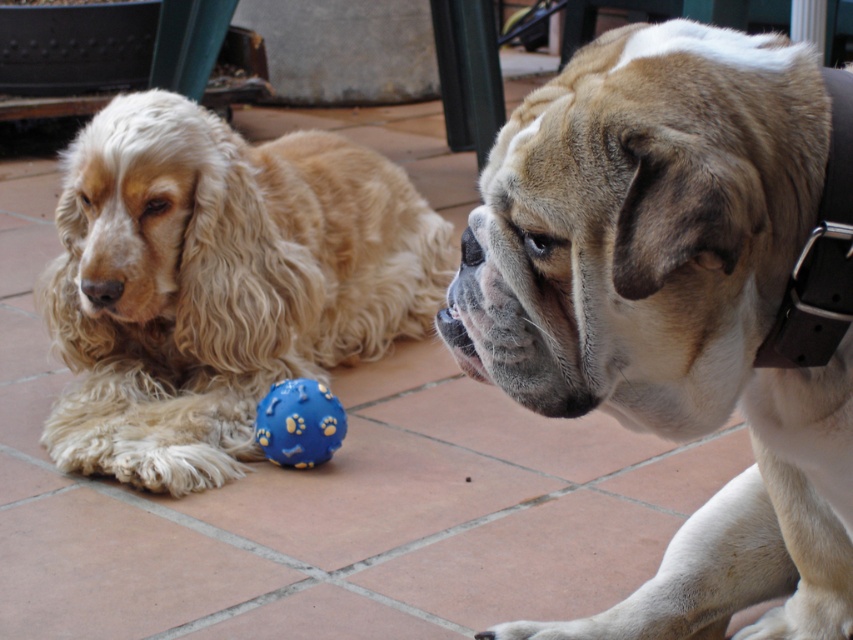
You are a dog trainer observing the two dogs in the scene. You notice the brown leather collar at center and the black rubber nose at center. Which object is positioned lower in the image?

The brown leather collar at center is below the black rubber nose at center, so the brown leather collar at center is positioned lower in the image.

You are a dog owner who wants to attach a GPS tracker to your dog. The tracker requires a collar width of at least 2 cm. Given the brown leather collar at center and the black rubber nose at center, which object can the GPS tracker be attached to?

The brown leather collar at center has a width that surpasses the black rubber nose at center, so the GPS tracker can be attached to the brown leather collar at center since it meets the minimum width requirement.

You are a dog owner who wants to place a new dog tag on the brown leather collar at center. You have a small tag that is the same height as the blue rubber ball at center. Will the tag fit vertically on the collar?

The brown leather collar at center is taller than the blue rubber ball at center. Since the tag is the same height as the blue rubber ball at center, it will fit vertically on the collar because the collar is taller than the tag.